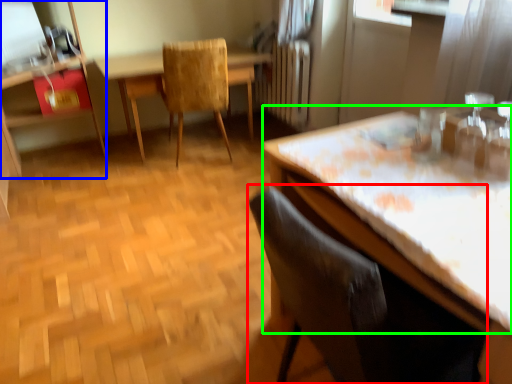
Question: Which object is positioned farthest from chair (highlighted by a red box)? Select from dresser (highlighted by a blue box) and counter top (highlighted by a green box).

Choices:
 (A) dresser
 (B) counter top

Answer: (A)